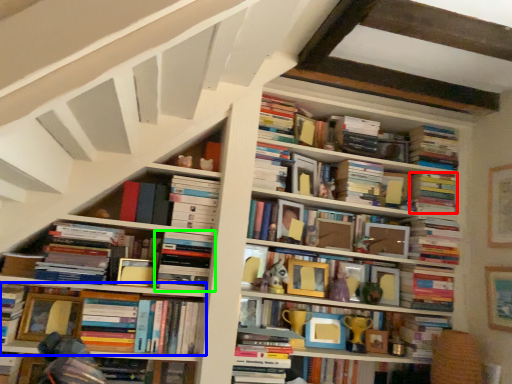
Question: Which is nearer to the book (highlighted by a red box)? book (highlighted by a blue box) or book (highlighted by a green box).

Choices:
 (A) book
 (B) book

Answer: (B)